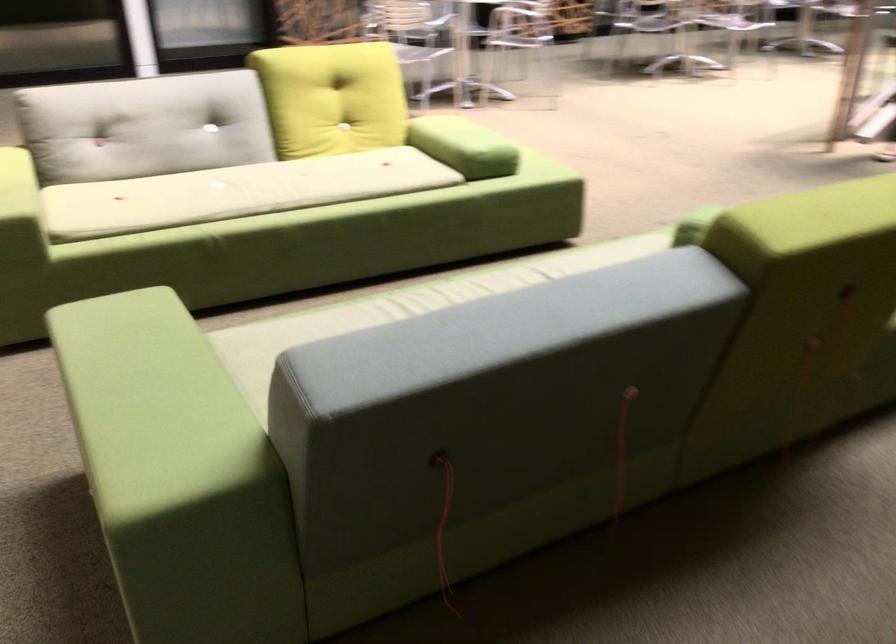
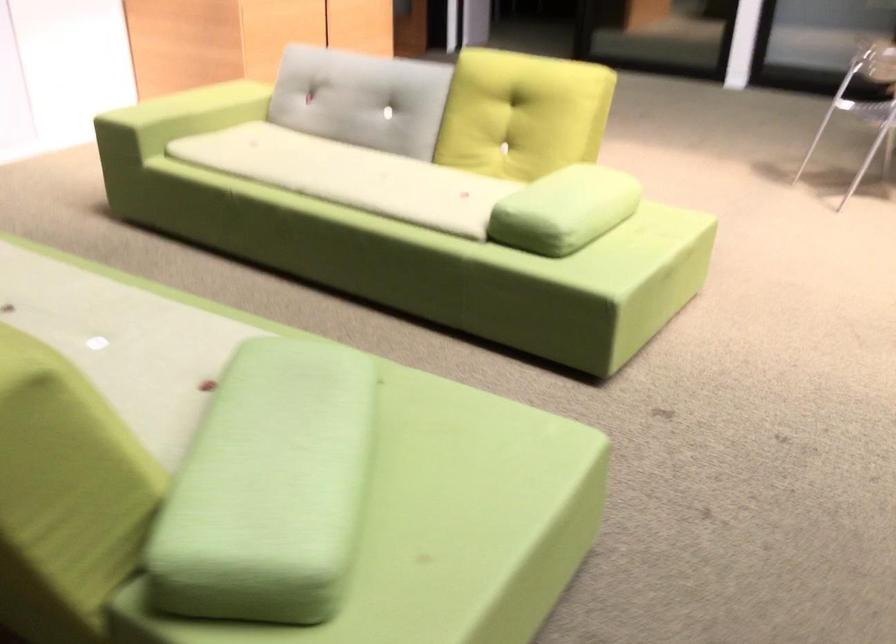
Locate, in the second image, the point that corresponds to [188,125] in the first image.

(362, 99)